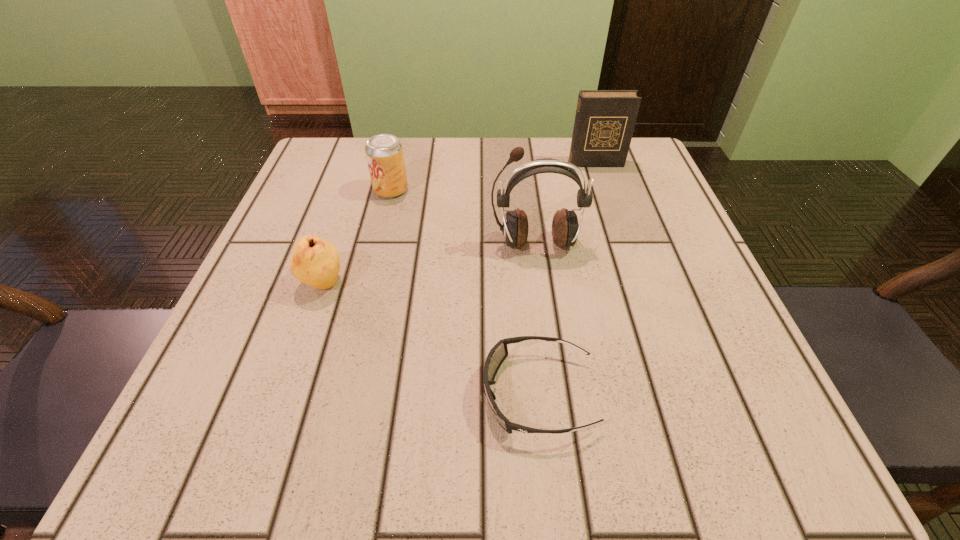
Identify the location of free space that is in between the fourth object from right to left and the fourth shortest object. This screenshot has height=540, width=960. (493, 177).

Locate an element on the screen. object that stands as the second closest to the nearest object is located at coordinates (314, 261).

Identify which object is located as the third nearest to the tallest object. Please provide its 2D coordinates. Your answer should be formatted as a tuple, i.e. [(x, y)], where the tuple contains the x and y coordinates of a point satisfying the conditions above.

[(604, 124)]

Locate an element on the screen. This screenshot has width=960, height=540. free region that satisfies the following two spatial constraints: 1. on the front cover of the rightmost object; 2. on the lenses of the nearest object is located at coordinates (673, 394).

Locate an element on the screen. The width and height of the screenshot is (960, 540). free space in the image that satisfies the following two spatial constraints: 1. on the front cover of the farthest object; 2. on the lenses of the goggles is located at coordinates (673, 394).

I want to click on vacant region that satisfies the following two spatial constraints: 1. on the front cover of the farthest object; 2. on the lenses of the shortest object, so click(x=673, y=394).

Image resolution: width=960 pixels, height=540 pixels. What are the coordinates of `free location that satisfies the following two spatial constraints: 1. on the ear pads of the tallest object; 2. on the lenses of the shortest object` in the screenshot? It's located at (556, 394).